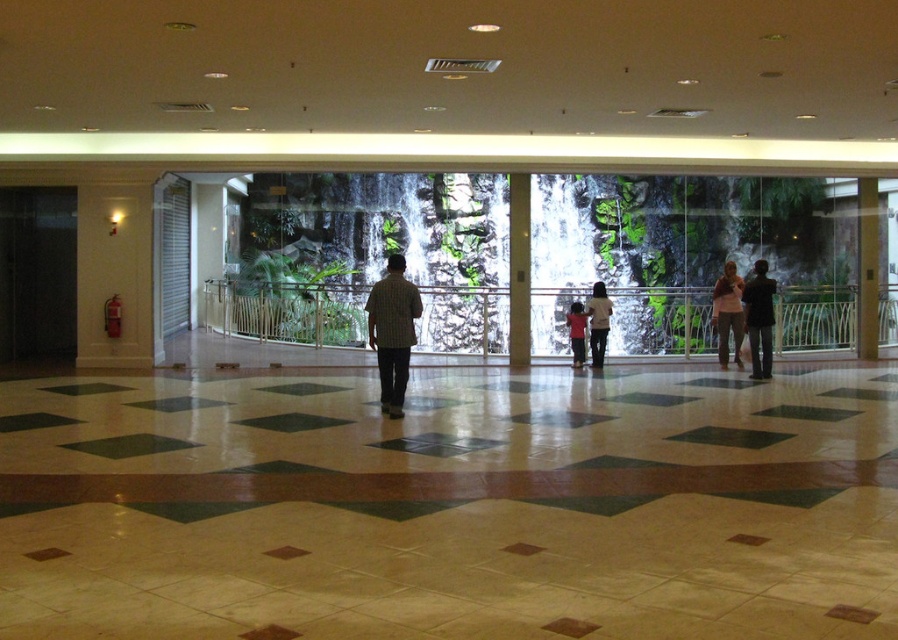
Who is positioned more to the left, plaid shirt at center or light pink fabric dress at center?

From the viewer's perspective, plaid shirt at center appears more on the left side.

Based on the photo, is plaid shirt at center to the left of light pink fabric dress at center from the viewer's perspective?

Correct, you'll find plaid shirt at center to the left of light pink fabric dress at center.

Who is more distant from viewer, (395,378) or (603,316)?

The point (603,316) is more distant.

Locate an element on the screen. plaid shirt at center is located at coordinates (392, 332).

Consider the image. Is green stone pillar at center further to the viewer compared to matte pink shirt at right?

Yes, green stone pillar at center is behind matte pink shirt at right.

Image resolution: width=898 pixels, height=640 pixels. Find the location of `green stone pillar at center`. green stone pillar at center is located at coordinates (518, 269).

Which of these two, green marble floor at center or brown wood pillar at right, stands shorter?

green marble floor at center

Find the location of a particular element. The width and height of the screenshot is (898, 640). green marble floor at center is located at coordinates (451, 508).